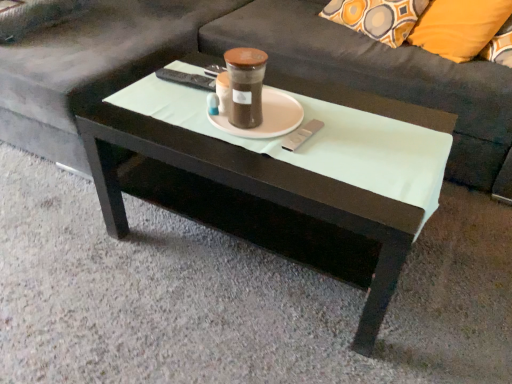
Question: Is dark gray fabric couch at center facing away from brown matte glass jar at center?

Choices:
 (A) yes
 (B) no

Answer: (B)

Question: From the image's perspective, would you say dark gray fabric couch at center is shown under brown matte glass jar at center?

Choices:
 (A) no
 (B) yes

Answer: (A)

Question: Is dark gray fabric couch at center next to brown matte glass jar at center and touching it?

Choices:
 (A) yes
 (B) no

Answer: (B)

Question: Is dark gray fabric couch at center smaller than brown matte glass jar at center?

Choices:
 (A) yes
 (B) no

Answer: (B)

Question: Does dark gray fabric couch at center have a lesser width compared to brown matte glass jar at center?

Choices:
 (A) no
 (B) yes

Answer: (A)

Question: Is brown matte glass jar at center inside the boundaries of dark gray fabric couch at center, or outside?

Choices:
 (A) inside
 (B) outside

Answer: (B)

Question: Looking at their shapes, would you say brown matte glass jar at center is wider or thinner than dark gray fabric couch at center?

Choices:
 (A) wide
 (B) thin

Answer: (B)

Question: From a real-world perspective, relative to dark gray fabric couch at center, is brown matte glass jar at center vertically above or below?

Choices:
 (A) above
 (B) below

Answer: (A)

Question: Considering their positions, is brown matte glass jar at center located in front of or behind dark gray fabric couch at center?

Choices:
 (A) behind
 (B) front

Answer: (B)

Question: Is white glossy coffee table at center inside the boundaries of brown matte glass jar at center, or outside?

Choices:
 (A) inside
 (B) outside

Answer: (B)

Question: In the image, is white glossy coffee table at center on the left side or the right side of brown matte glass jar at center?

Choices:
 (A) left
 (B) right

Answer: (B)

Question: Is point (379, 198) closer or farther from the camera than point (251, 54)?

Choices:
 (A) farther
 (B) closer

Answer: (B)

Question: From a real-world perspective, is white glossy coffee table at center above or below brown matte glass jar at center?

Choices:
 (A) below
 (B) above

Answer: (A)

Question: Looking at the image, does orange fabric pillow at upper right seem bigger or smaller compared to white glossy coffee table at center?

Choices:
 (A) small
 (B) big

Answer: (A)

Question: Is orange fabric pillow at upper right to the left or to the right of white glossy coffee table at center in the image?

Choices:
 (A) left
 (B) right

Answer: (B)